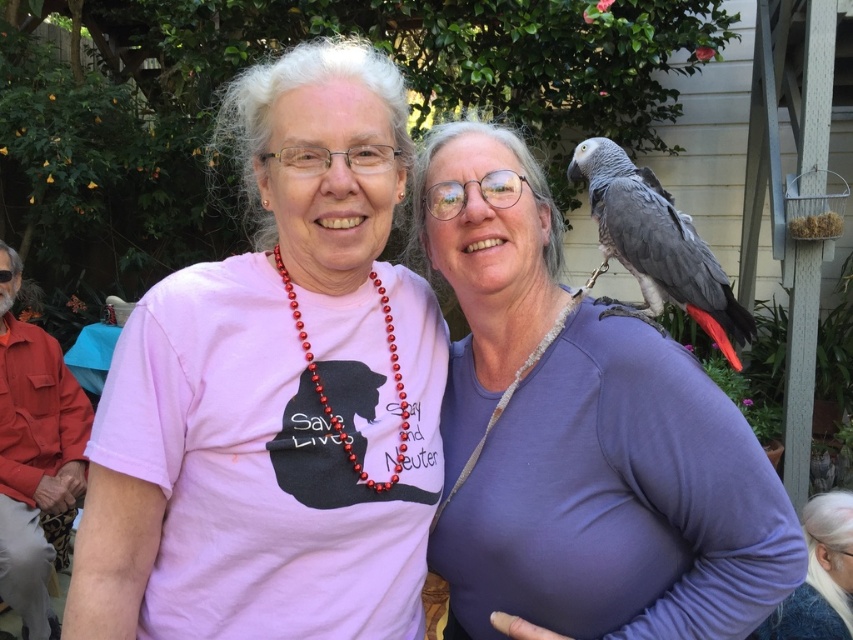
Question: Where is matte gray parrot at upper right located in relation to gray matte parrot at upper right in the image?

Choices:
 (A) right
 (B) left

Answer: (B)

Question: Is matte gray parrot at upper right above gray matte parrot at upper right?

Choices:
 (A) yes
 (B) no

Answer: (B)

Question: Which point is closer to the camera taking this photo?

Choices:
 (A) (577, 586)
 (B) (616, 198)

Answer: (A)

Question: Does matte gray parrot at upper right appear over gray matte parrot at upper right?

Choices:
 (A) no
 (B) yes

Answer: (A)